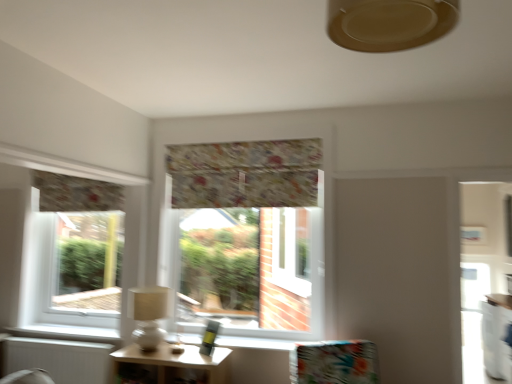
Question: Considering the positions of wooden table at lower center and floral fabric valance at center, which is the first window in right-to-left order, in the image, is wooden table at lower center wider or thinner than floral fabric valance at center, which is the first window in right-to-left order,?

Choices:
 (A) thin
 (B) wide

Answer: (B)

Question: From a real-world perspective, is wooden table at lower center above or below floral fabric valance at center, which is the first window in right-to-left order?

Choices:
 (A) below
 (B) above

Answer: (A)

Question: Which is farther from the white glossy counter at lower right?

Choices:
 (A) floral fabric curtain at center, the 2th curtain in the left-to-right sequence
 (B) floral fabric curtain at left, which is the second curtain from right to left
 (C) floral fabric valance at center, the second window positioned from the left
 (D) beige fabric lampshade at left
 (E) transparent glass window at left, the 1th window in the left-to-right sequence

Answer: (B)

Question: Estimate the real-world distances between objects in this image. Which object is closer to the floral fabric cushion at center?

Choices:
 (A) white matte radiator at lower left
 (B) beige matte ceiling fan at upper center
 (C) beige fabric lampshade at left
 (D) white glossy counter at lower right
 (E) floral fabric valance at center, which is the first window in right-to-left order

Answer: (E)